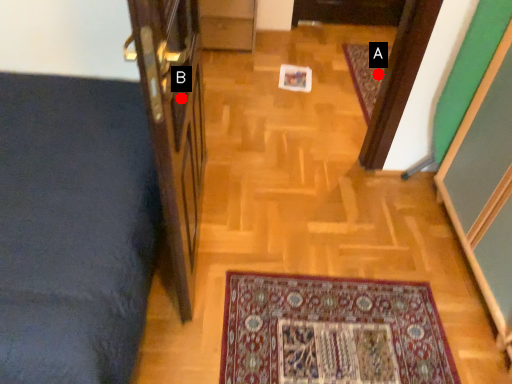
Question: Two points are circled on the image, labeled by A and B beside each circle. Which point is farther to the camera?

Choices:
 (A) A is further
 (B) B is further

Answer: (A)